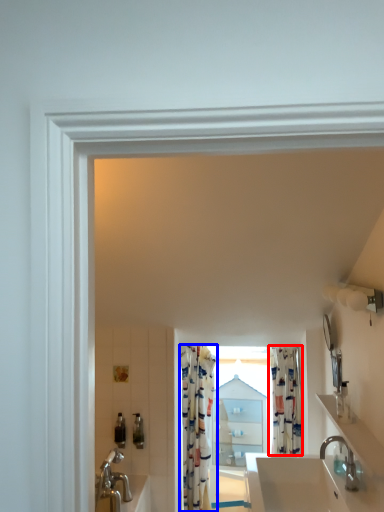
Question: Which object appears farthest to the camera in this image, shower curtain (highlighted by a red box) or shower curtain (highlighted by a blue box)?

Choices:
 (A) shower curtain
 (B) shower curtain

Answer: (B)